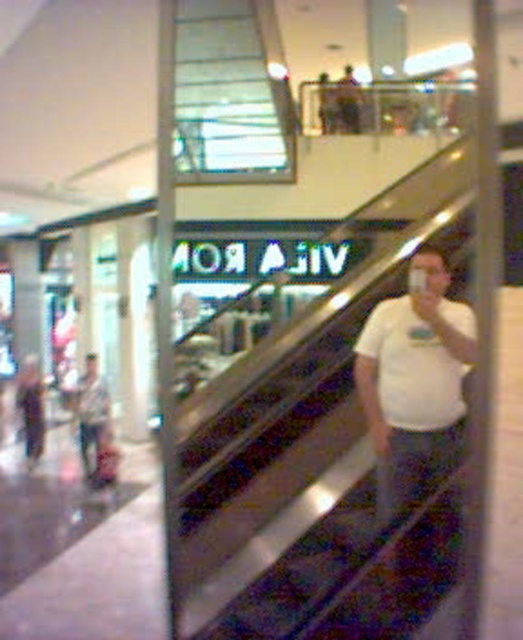
Is point (414, 486) positioned in front of point (98, 449)?

That is True.

Is white matte t-shirt at center bigger than matte gray shirt at lower left?

Actually, white matte t-shirt at center might be smaller than matte gray shirt at lower left.

This screenshot has width=523, height=640. In order to click on white matte t-shirt at center in this screenshot , I will do `click(415, 380)`.

Identify the location of white matte t-shirt at center. The width and height of the screenshot is (523, 640). (415, 380).